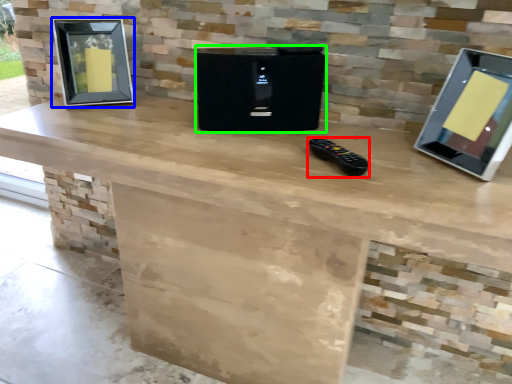
Question: Based on their relative distances, which object is farther from game controller (highlighted by a red box)? Choose from picture frame (highlighted by a blue box) and appliance (highlighted by a green box).

Choices:
 (A) picture frame
 (B) appliance

Answer: (A)